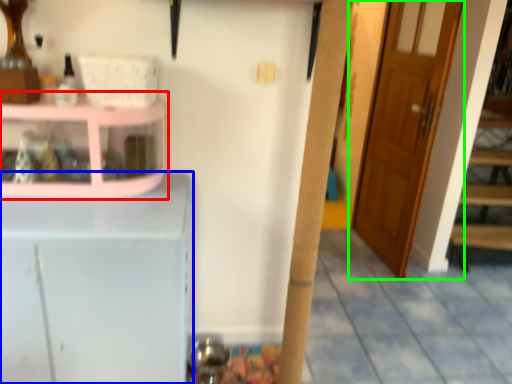
Question: Based on their relative distances, which object is farther from shelf (highlighted by a red box)? Choose from cabinetry (highlighted by a blue box) and door (highlighted by a green box).

Choices:
 (A) cabinetry
 (B) door

Answer: (B)